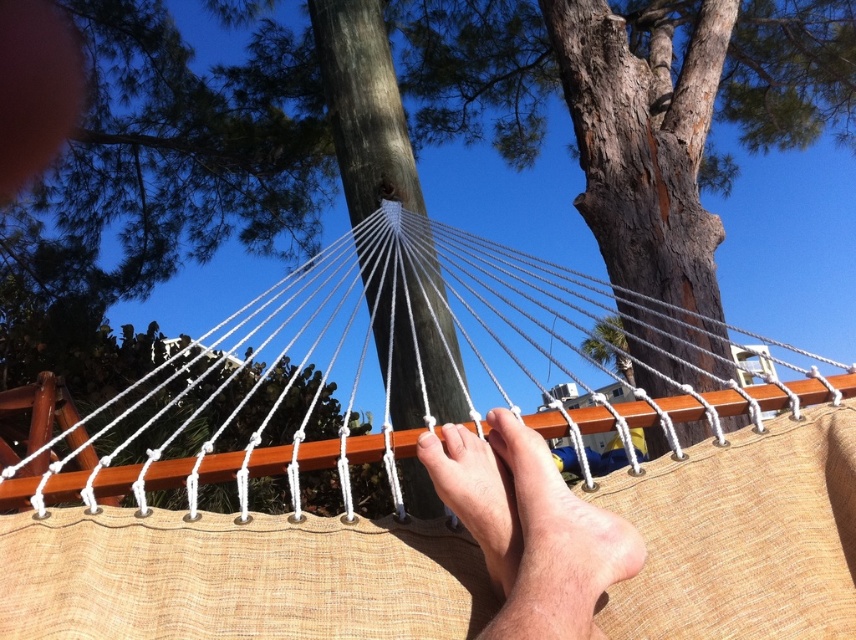
Measure the distance between point (x=773, y=342) and camera.

Point (x=773, y=342) is 1.03 meters from camera.

The width and height of the screenshot is (856, 640). I want to click on white rope at center, so click(348, 356).

Does point (62, 440) come behind point (589, 515)?

Yes, point (62, 440) is farther from viewer.

In order to click on white rope at center in this screenshot , I will do `click(348, 356)`.